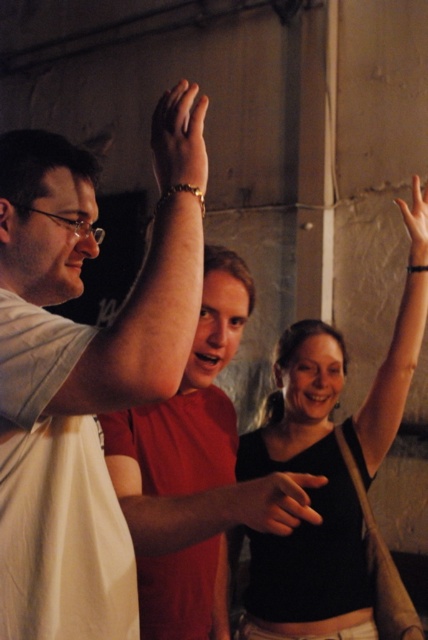
You are a jewelry designer observing the scene. You notice the matte gold bracelet at upper center and the smooth skin hand at upper right. Which object has a smaller width?

The matte gold bracelet at upper center is thinner than the smooth skin hand at upper right, so the matte gold bracelet at upper center has a smaller width.